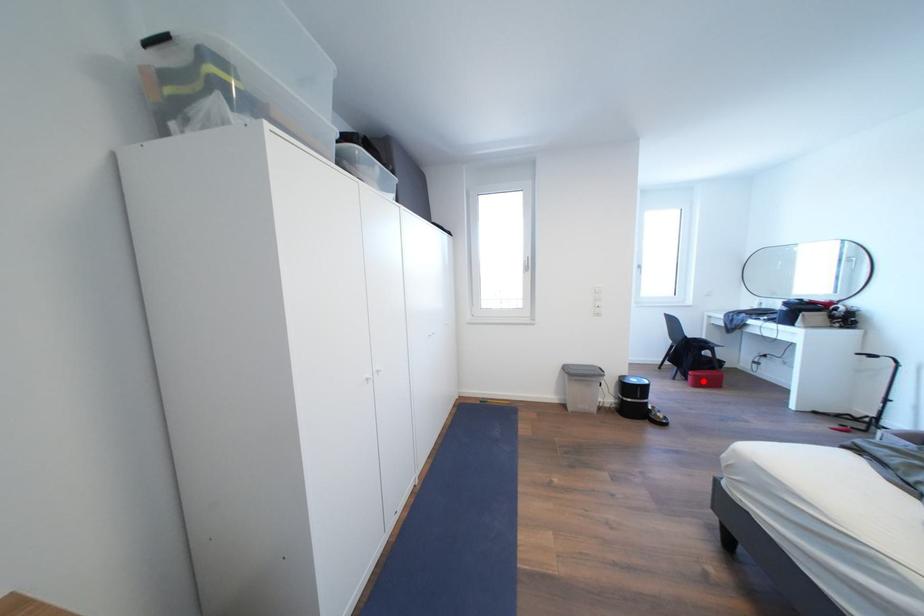
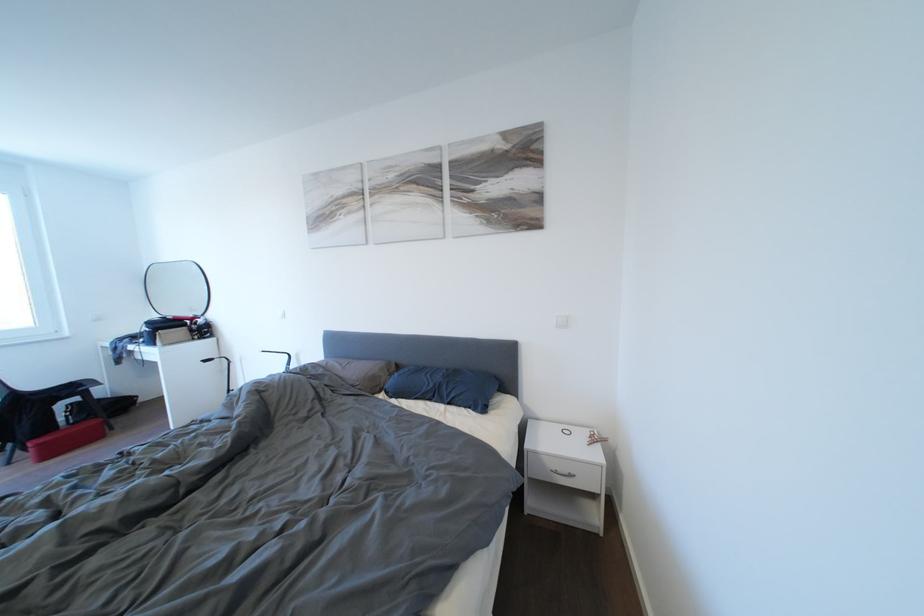
Question: I am providing you with two images of the same scene from different viewpoints. Given a red point in image1, look at the same physical point in image2. Is it:

Choices:
 (A) Closer to the viewpoint
 (B) Farther from the viewpoint

Answer: (A)